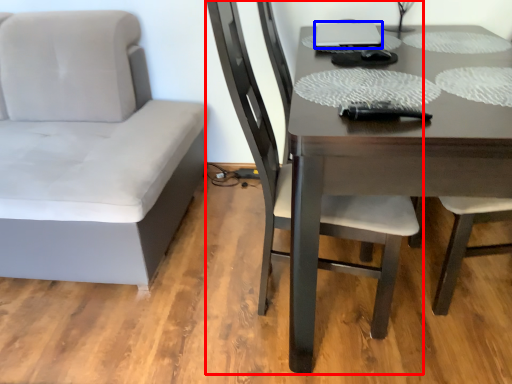
Question: Which object is closer to the camera taking this photo, chair (highlighted by a red box) or laptop (highlighted by a blue box)?

Choices:
 (A) chair
 (B) laptop

Answer: (A)